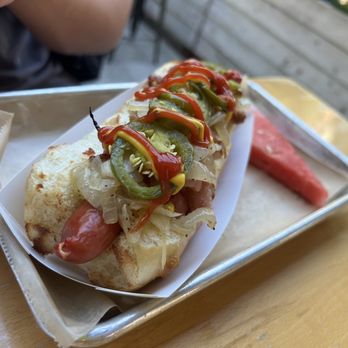
Identify the location of tray. (254, 247).